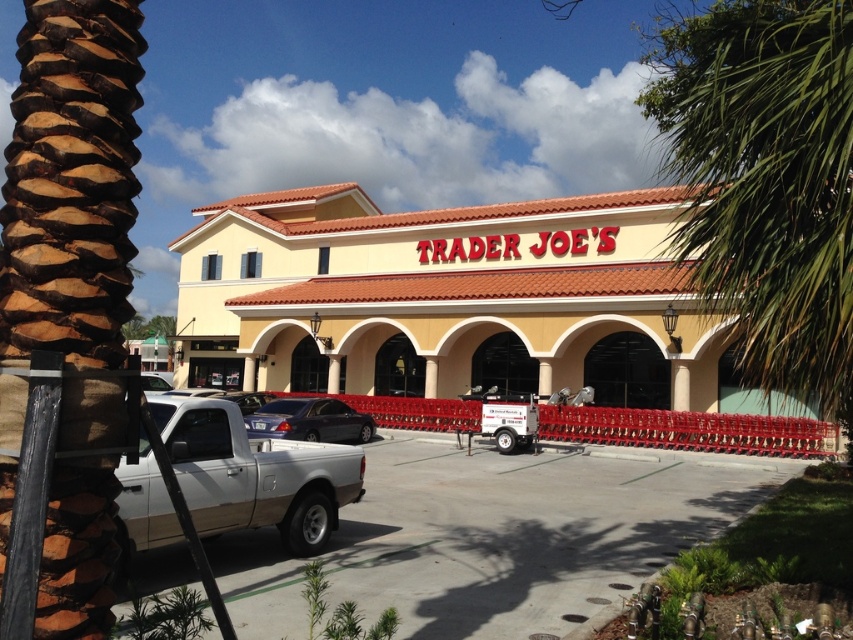
You are a photographer planning to capture the Trader Joe store with both the brown textured palm tree at left and the satin black sedan at center in the frame. Based on their sizes, which object would appear smaller in the photo?

The brown textured palm tree at left would appear smaller in the photo because its width is less than that of the satin black sedan at center.